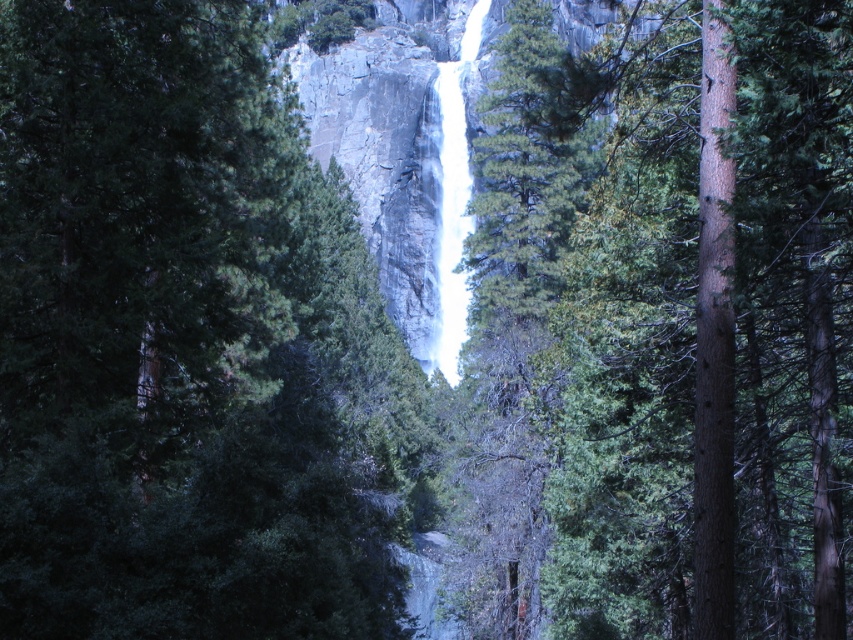
Question: Which of the following is the closest to the observer?

Choices:
 (A) (271, 529)
 (B) (805, 470)

Answer: (A)

Question: Can you confirm if green matte tree at center is smaller than green rough bark tree at center?

Choices:
 (A) no
 (B) yes

Answer: (B)

Question: Which object appears closest to the camera in this image?

Choices:
 (A) green matte tree at center
 (B) green rough bark tree at center

Answer: (A)

Question: Which point appears farthest from the camera in this image?

Choices:
 (A) (614, 129)
 (B) (137, 12)

Answer: (A)

Question: Can you confirm if green matte tree at center is wider than green rough bark tree at center?

Choices:
 (A) no
 (B) yes

Answer: (A)

Question: Can you confirm if green matte tree at center is positioned above green rough bark tree at center?

Choices:
 (A) no
 (B) yes

Answer: (A)